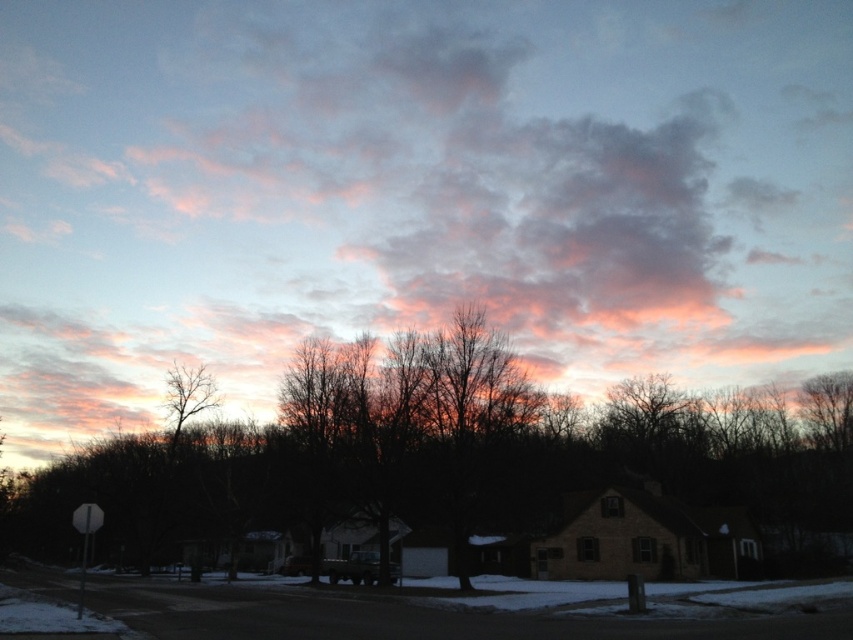
Is pink fluffy cloud at upper center positioned before silhouette bare tree at center?

No, pink fluffy cloud at upper center is further to the viewer.

Does pink fluffy cloud at upper center have a lesser height compared to silhouette bare tree at center?

No.

Does point (683, 291) lie behind point (520, 385)?

Yes, it is.

Where is `pink fluffy cloud at upper center`? This screenshot has height=640, width=853. pink fluffy cloud at upper center is located at coordinates (415, 189).

Is pink fluffy cloud at upper center positioned at the back of bare branches at left?

That is True.

Measure the distance between point [514,134] and camera.

The distance of point [514,134] from camera is 157.93 meters.

Is point (814, 177) behind point (204, 404)?

Yes, it is behind point (204, 404).

The image size is (853, 640). Find the location of `pink fluffy cloud at upper center`. pink fluffy cloud at upper center is located at coordinates (415, 189).

Describe the element at coordinates (438, 452) in the screenshot. Image resolution: width=853 pixels, height=640 pixels. I see `silhouette bare tree at center` at that location.

Can you confirm if silhouette bare tree at center is thinner than bare branches at left?

In fact, silhouette bare tree at center might be wider than bare branches at left.

Locate an element on the screen. This screenshot has height=640, width=853. silhouette bare tree at center is located at coordinates (438, 452).